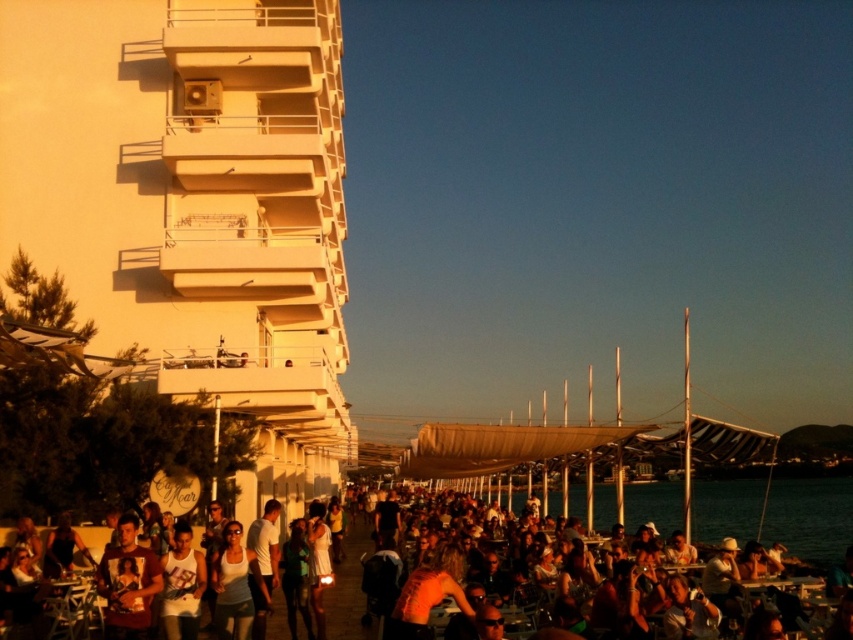
You are standing at the origin point of the coordinate system in the image. You want to find the orange tank top at center. In which direction should you move to reach it?

The orange tank top at center is located at coordinate point (x=778, y=509), which is to the right and slightly above your current position. Move towards the right and upwards to reach it.

You are standing at the point marked by the coordinate point [778,509] in the image. What object is located exactly at that coordinate?

The point [778,509] marks the orange tank top at center.